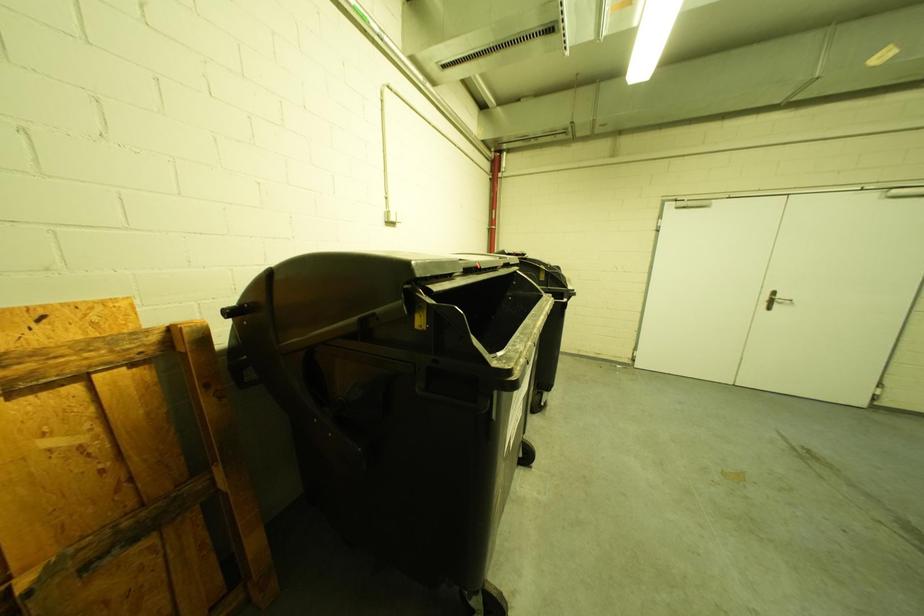
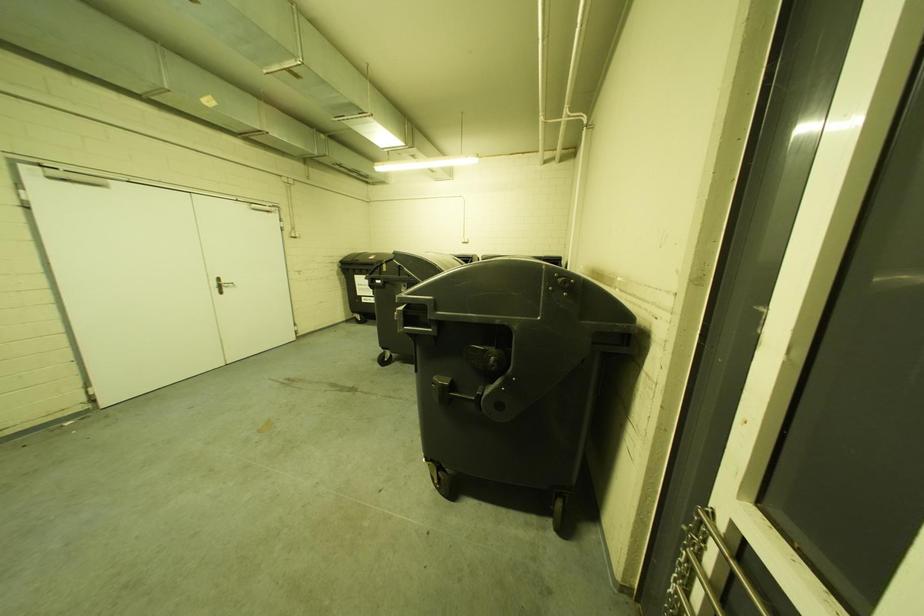
How did the camera likely rotate?

The camera's rotation is toward right-down.